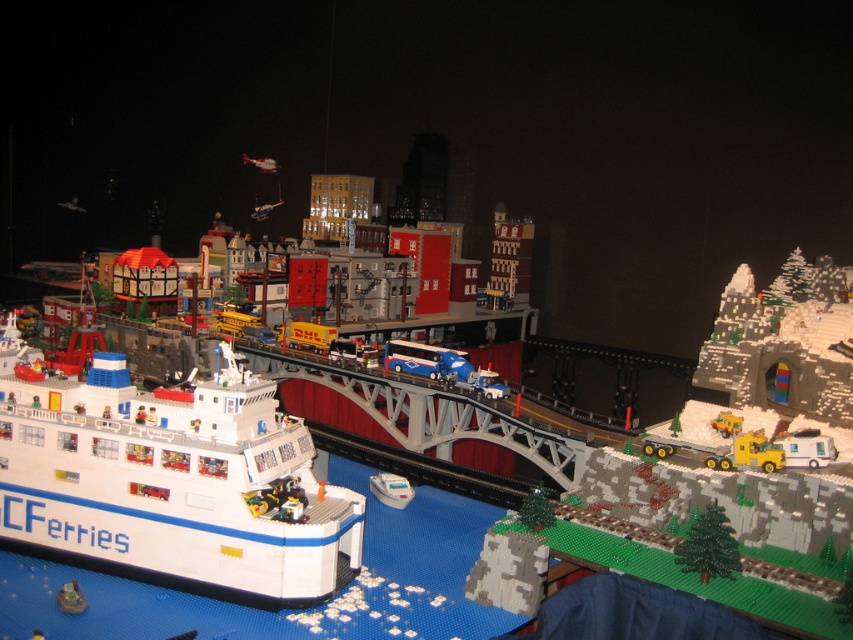
Looking at this image, between blue metallic bus at center and white plastic boat at lower center, which one appears on the right side from the viewer's perspective?

Positioned to the right is blue metallic bus at center.

Can you confirm if blue metallic bus at center is bigger than white plastic boat at lower center?

Correct, blue metallic bus at center is larger in size than white plastic boat at lower center.

Who is more forward, (485, 394) or (412, 493)?

Point (412, 493) is in front.

Identify the location of blue metallic bus at center. (442, 365).

Does yellow plastic truck at right lie behind blue metallic bus at center?

No, yellow plastic truck at right is in front of blue metallic bus at center.

Who is positioned more to the right, yellow plastic truck at right or blue metallic bus at center?

From the viewer's perspective, yellow plastic truck at right appears more on the right side.

What are the coordinates of `yellow plastic truck at right` in the screenshot? It's located at (724, 515).

The width and height of the screenshot is (853, 640). What do you see at coordinates (170, 480) in the screenshot? I see `white plastic ferry at lower left` at bounding box center [170, 480].

Find the location of a particular element. Image resolution: width=853 pixels, height=640 pixels. white plastic ferry at lower left is located at coordinates (170, 480).